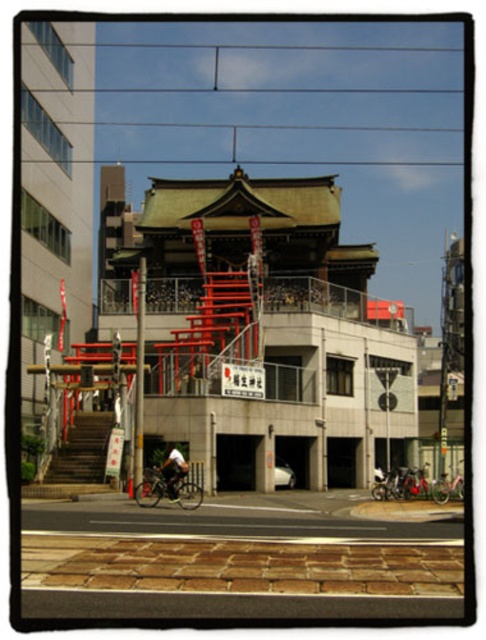
Consider the image. You are standing in front of the traditional Japanese shrine with red torii gates. You see two bicycles, a silver metallic bicycle at center and a shiny metallic bicycle at center. Which bicycle is positioned to the left?

The silver metallic bicycle at center is to the left of the shiny metallic bicycle at center.

Based on the scene description, where is the white fabric shirt at center located in terms of coordinates?

The white fabric shirt at center is located at coordinates point [173,472].